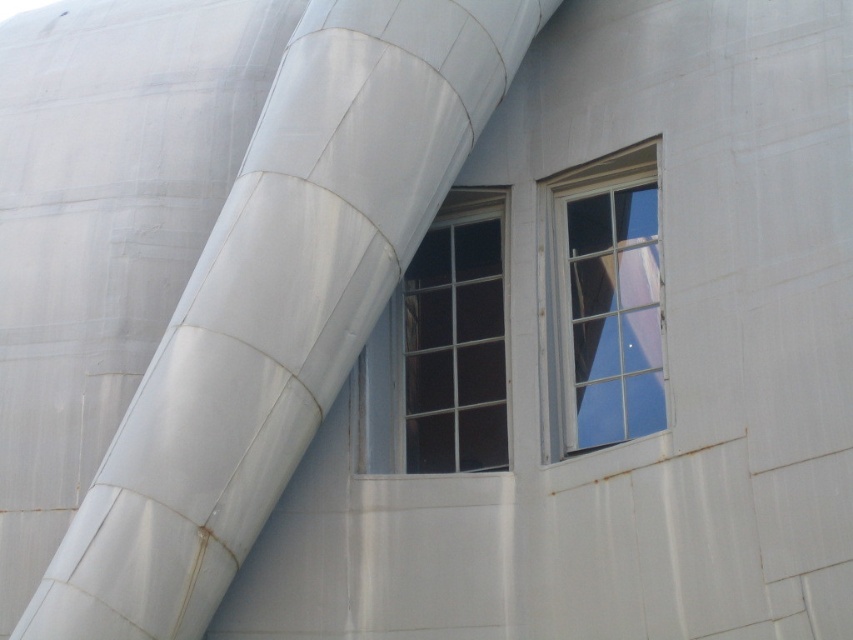
Question: Can you confirm if clear glass window at center is thinner than clear glass window at upper right?

Choices:
 (A) no
 (B) yes

Answer: (A)

Question: Is clear glass window at center above clear glass window at upper right?

Choices:
 (A) no
 (B) yes

Answer: (A)

Question: Does clear glass window at center appear on the left side of clear glass window at upper right?

Choices:
 (A) yes
 (B) no

Answer: (A)

Question: Which point is farther to the camera?

Choices:
 (A) (631, 225)
 (B) (438, 321)

Answer: (B)

Question: Which point is closer to the camera?

Choices:
 (A) (566, 186)
 (B) (440, 378)

Answer: (B)